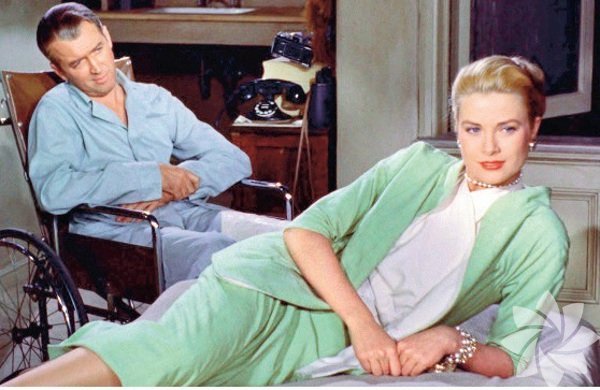
At what (x,y) coordinates should I click in order to perform the action: click on cabinet. Please return your answer as a coordinate pair (x, y). The width and height of the screenshot is (600, 390). Looking at the image, I should click on (232, 32).